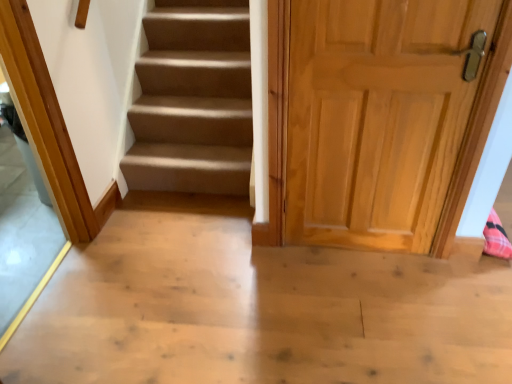
Identify the location of vacant space to the right of light brown wood door at right. (453, 280).